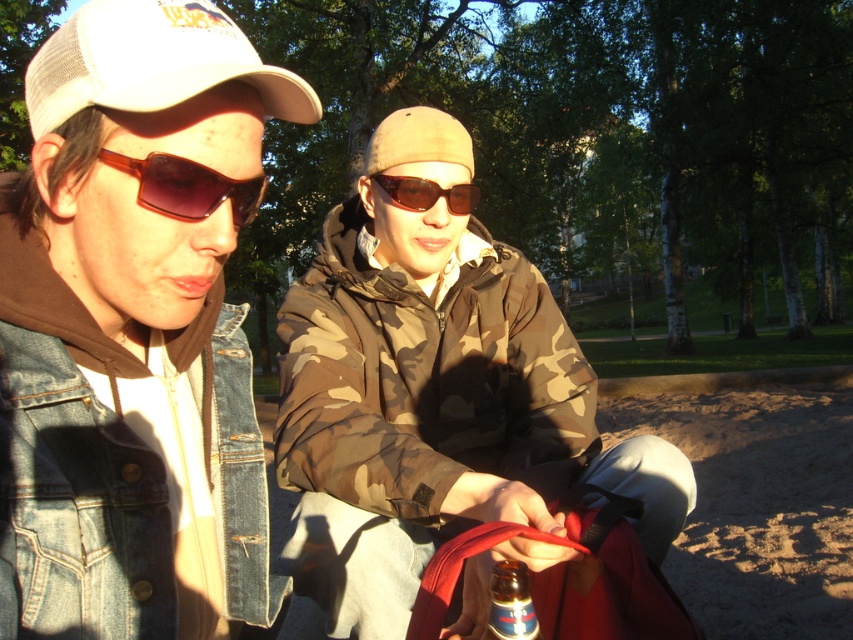
Question: Is denim jacket at upper left smaller than metallic silver bottle at center?

Choices:
 (A) yes
 (B) no

Answer: (B)

Question: Can you confirm if denim jacket at upper left is positioned above camo jacket at center?

Choices:
 (A) yes
 (B) no

Answer: (A)

Question: Does white mesh baseball cap at upper left have a greater width compared to sunglasses at center?

Choices:
 (A) no
 (B) yes

Answer: (B)

Question: Which point is farther to the camera?

Choices:
 (A) denim jacket at upper left
 (B) metallic silver bottle at center

Answer: (B)

Question: Which point is closer to the camera?

Choices:
 (A) (494, 570)
 (B) (207, 10)
 (C) (425, 195)

Answer: (B)

Question: Which point is farther to the camera?

Choices:
 (A) (112, 97)
 (B) (370, 403)
 (C) (212, 200)

Answer: (B)